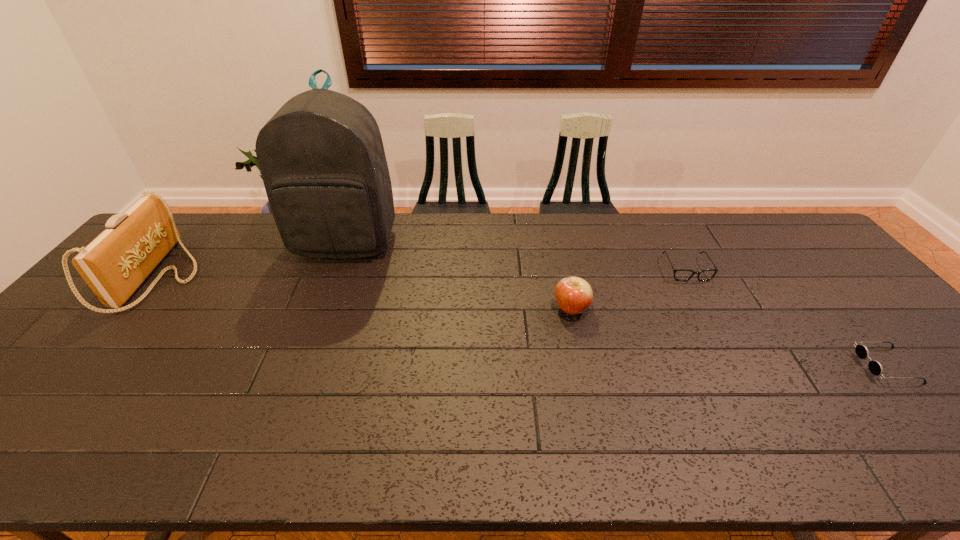
The image size is (960, 540). In order to click on vacant space in between the second object from right to left and the nearest object in this screenshot , I will do `click(786, 317)`.

Find the location of a particular element. The image size is (960, 540). free space between the second tallest object and the spectacles is located at coordinates (422, 273).

I want to click on vacant area that lies between the third object from right to left and the spectacles, so [629, 289].

Where is `free spot between the sunglasses and the tallest object`? The image size is (960, 540). free spot between the sunglasses and the tallest object is located at coordinates (616, 304).

Where is `empty space that is in between the third tallest object and the nearest object`? Image resolution: width=960 pixels, height=540 pixels. empty space that is in between the third tallest object and the nearest object is located at coordinates (729, 338).

Where is `free spot between the apple and the rightmost object`? This screenshot has height=540, width=960. free spot between the apple and the rightmost object is located at coordinates (729, 338).

Identify which object is located as the second nearest to the spectacles. Please provide its 2D coordinates. Your answer should be formatted as a tuple, i.e. [(x, y)], where the tuple contains the x and y coordinates of a point satisfying the conditions above.

[(862, 352)]

Locate which object is the closest to the backpack. Please provide its 2D coordinates. Your answer should be formatted as a tuple, i.e. [(x, y)], where the tuple contains the x and y coordinates of a point satisfying the conditions above.

[(114, 265)]

Locate an element on the screen. Image resolution: width=960 pixels, height=540 pixels. vacant space that satisfies the following two spatial constraints: 1. on the front-facing side of the second object from right to left; 2. on the decorative side of the second tallest object is located at coordinates [x=690, y=277].

Identify the location of free region that satisfies the following two spatial constraints: 1. on the front-facing side of the second object from right to left; 2. on the decorative side of the second tallest object. Image resolution: width=960 pixels, height=540 pixels. (690, 277).